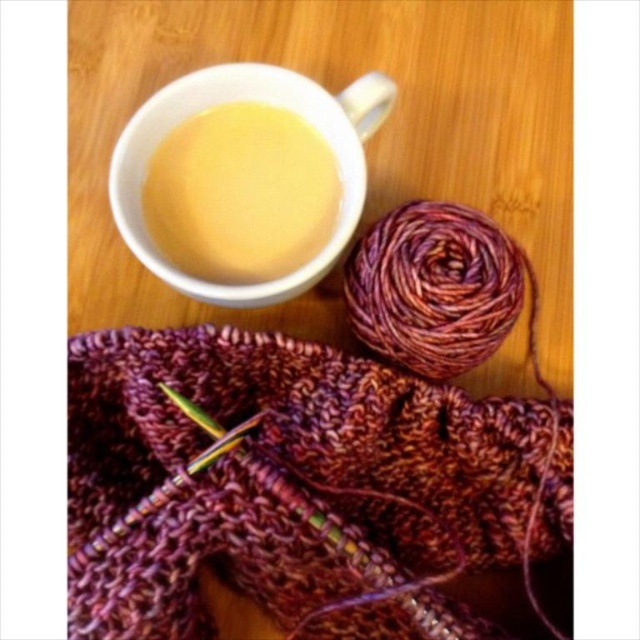
You are organizing a craft fair booth and need to place the knitted wool scarf at center and the yellow matte mug at upper center on a table. The table has a 10 inch wide shelf in front of it. Can you place both items on the shelf without overlapping them?

The knitted wool scarf at center is 12.01 inches from the yellow matte mug at upper center, which means the distance between them is greater than the shelf width of 10 inches. Therefore, they cannot be placed on the shelf without overlapping.

You are a delivery robot that needs to place a small package on the wooden surface. The package must be placed at the point with coordinates [276,477]. However, there is a knitted wool scarf at center. Can you place the package there?

The point [276,477] is on the knitted wool scarf at center, so you cannot place the package there as it would be on top of the scarf.

You are organizing items on a wooden desk and need to place both the knitted wool scarf at center and the yellow matte mug at upper center. According to the image, which item is located to the right of the other?

The knitted wool scarf at center is positioned on the right side of yellow matte mug at upper center, so the scarf is to the right of the mug.